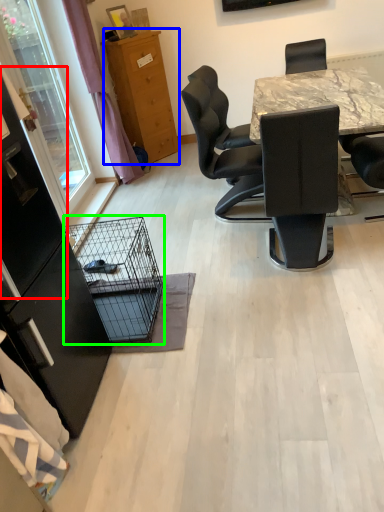
Question: Considering the real-world distances, which object is closest to screen door (highlighted by a red box)? cabinetry (highlighted by a blue box) or bird cage (highlighted by a green box).

Choices:
 (A) cabinetry
 (B) bird cage

Answer: (B)